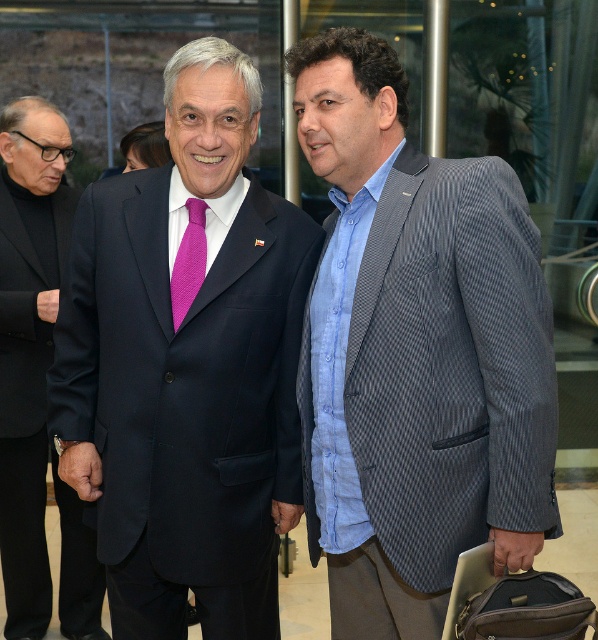
You are a photographer at a formal event. You need to capture a closeup shot of the matte black suit at center and the pink textured tie at center in the same frame. The camera has a minimum focus distance of 6 inches. Will you be able to focus on both objects simultaneously?

The matte black suit at center and pink textured tie at center are 7.65 inches apart from each other, which is greater than the camera minimum focus distance of 6 inches. Therefore, the photographer can focus on both objects simultaneously.

You are trying to decide which man to approach for a quick conversation. The gray textured blazer at center and the black wool suit at left are both in your line of sight. Based on their clothing, which one might have more space between their arms and the fabric of their blazer or suit?

The gray textured blazer at center might be wider than the black wool suit at left, so the man wearing the gray textured blazer at center might have more space between his arms and the fabric of his blazer.